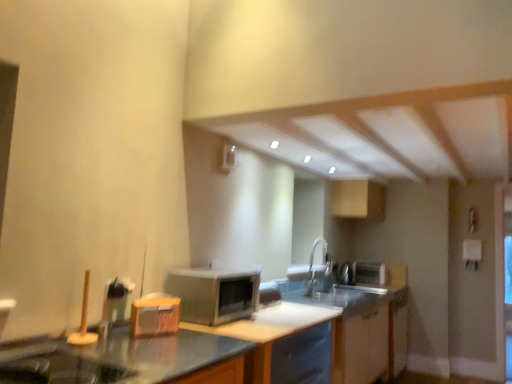
Where is `satin silver toaster at upper right, positioned as the second appliance in front-to-back order`? satin silver toaster at upper right, positioned as the second appliance in front-to-back order is located at coordinates (369, 273).

What is the approximate height of satin silver toaster at upper right, which is counted as the first appliance, starting from the right?

8.57 inches.

What do you see at coordinates (320, 272) in the screenshot? This screenshot has height=384, width=512. I see `silver metallic faucet at center` at bounding box center [320, 272].

The width and height of the screenshot is (512, 384). What do you see at coordinates (214, 294) in the screenshot?
I see `satin silver microwave at center` at bounding box center [214, 294].

Measure the distance between satin silver microwave at center and camera.

satin silver microwave at center is 6.93 feet away from camera.

The image size is (512, 384). Identify the location of white glossy cabinet at lower center, the first cabinetry positioned from the bottom. 362,328.

Measure the distance between point (328, 337) and camera.

Point (328, 337) is 2.63 meters away from camera.

The image size is (512, 384). Find the location of `white glossy counter top at center`. white glossy counter top at center is located at coordinates (269, 330).

Considering the sizes of satin silver microwave at center and silver metallic faucet at center in the image, is satin silver microwave at center bigger or smaller than silver metallic faucet at center?

In the image, satin silver microwave at center appears to be larger than silver metallic faucet at center.

Consider the image. Is satin silver microwave at center in contact with silver metallic faucet at center?

satin silver microwave at center and silver metallic faucet at center are clearly separated.

I want to click on faucet behind the satin silver microwave at center, so click(x=320, y=272).

Can you confirm if satin silver microwave at center is shorter than silver metallic faucet at center?

Yes, satin silver microwave at center is shorter than silver metallic faucet at center.

Are silver metallic faucet at center and matte wood cabinet at center, the second cabinetry from the front, making contact?

No, silver metallic faucet at center is not next to matte wood cabinet at center, the second cabinetry from the front.

Considering their positions, is silver metallic faucet at center located in front of or behind matte wood cabinet at center, placed as the first cabinetry when sorted from back to front?

Visually, silver metallic faucet at center is located in front of matte wood cabinet at center, placed as the first cabinetry when sorted from back to front.

Is silver metallic faucet at center wider than matte wood cabinet at center, acting as the 2th cabinetry starting from the bottom?

No, silver metallic faucet at center is not wider than matte wood cabinet at center, acting as the 2th cabinetry starting from the bottom.

Between silver metallic faucet at center and matte wood cabinet at center, acting as the 2th cabinetry starting from the bottom, which one has more height?

silver metallic faucet at center.

Is point (316, 319) in front of point (138, 313)?

No.

Based on the photo, who is more distant, white glossy counter top at center or wooden cutting board at left, which ranks as the first appliance in front-to-back order?

Positioned behind is wooden cutting board at left, which ranks as the first appliance in front-to-back order.

In terms of width, does white glossy counter top at center look wider or thinner when compared to wooden cutting board at left, the first appliance from the left?

In the image, white glossy counter top at center appears to be wider than wooden cutting board at left, the first appliance from the left.

Could wooden cutting board at left, the first appliance from the left, be considered to be inside white glossy counter top at center?

That's incorrect, wooden cutting board at left, the first appliance from the left, is not inside white glossy counter top at center.

Could you measure the distance between white glossy cabinet at lower center, placed as the 2th cabinetry when sorted from top to bottom, and white glossy counter top at center?

They are 31.95 inches apart.

Is white glossy cabinet at lower center, the second cabinetry from the back, far from white glossy counter top at center?

No, there isn't a large distance between white glossy cabinet at lower center, the second cabinetry from the back, and white glossy counter top at center.

Is white glossy cabinet at lower center, placed as the 2th cabinetry when sorted from top to bottom, turned away from white glossy counter top at center?

No, white glossy cabinet at lower center, placed as the 2th cabinetry when sorted from top to bottom, is not facing away from white glossy counter top at center.

What's the angular difference between white glossy cabinet at lower center, the second cabinetry from the back, and white glossy counter top at center's facing directions?

0.01 degrees.

Does wooden cutting board at left, the 1th appliance when ordered from top to bottom, have a lesser height compared to matte wood cabinet at center, the second cabinetry from the front?

Yes, wooden cutting board at left, the 1th appliance when ordered from top to bottom, is shorter than matte wood cabinet at center, the second cabinetry from the front.

Which is closer to the camera, (132, 328) or (358, 189)?

The point (132, 328) is in front.

In the scene shown: Is wooden cutting board at left, which appears as the second appliance when viewed from the back, turned away from matte wood cabinet at center, the first cabinetry in the top-to-bottom sequence?

No, matte wood cabinet at center, the first cabinetry in the top-to-bottom sequence, is not at the back of wooden cutting board at left, which appears as the second appliance when viewed from the back.

Which is behind, wooden cutting board at left, the first appliance from the left, or matte wood cabinet at center, acting as the 2th cabinetry starting from the bottom?

matte wood cabinet at center, acting as the 2th cabinetry starting from the bottom, is more distant.

From the image's perspective, which is below, satin silver microwave at center or wooden cutting board at left, which ranks as the second appliance in bottom-to-top order?

satin silver microwave at center, from the image's perspective.

Which object is closer to the camera, satin silver microwave at center or wooden cutting board at left, marked as the second appliance in a right-to-left arrangement?

wooden cutting board at left, marked as the second appliance in a right-to-left arrangement, is more forward.

Is satin silver microwave at center inside the boundaries of wooden cutting board at left, marked as the second appliance in a right-to-left arrangement, or outside?

satin silver microwave at center is spatially situated outside wooden cutting board at left, marked as the second appliance in a right-to-left arrangement.

Is point (275, 367) less distant than point (131, 312)?

No, it is not.

Consider the image. Is white glossy cabinet at lower center, the first cabinetry positioned from the bottom, not inside wooden cutting board at left, marked as the second appliance in a right-to-left arrangement?

Yes, white glossy cabinet at lower center, the first cabinetry positioned from the bottom, is outside of wooden cutting board at left, marked as the second appliance in a right-to-left arrangement.

From the image's perspective, is white glossy cabinet at lower center, the first cabinetry positioned from the bottom, located above or below wooden cutting board at left, the first appliance from the left?

white glossy cabinet at lower center, the first cabinetry positioned from the bottom, is situated lower than wooden cutting board at left, the first appliance from the left, in the image.

At what (x,y) coordinates should I click in order to perform the action: click on microwave oven on the left of silver metallic faucet at center. Please return your answer as a coordinate pair (x, y). This screenshot has width=512, height=384. Looking at the image, I should click on (214, 294).

You are a GUI agent. You are given a task and a screenshot of the screen. Output one action in this format:
    pyautogui.click(x=<x>, y=<y>)
    Task: Click on the faucet in front of the matte wood cabinet at center, acting as the 2th cabinetry starting from the bottom
    Image resolution: width=512 pixels, height=384 pixels.
    Given the screenshot: What is the action you would take?
    pyautogui.click(x=320, y=272)

From the picture: Which object lies nearer to the anchor point wooden cutting board at left, which ranks as the first appliance in front-to-back order, white glossy cabinet at lower center, the first cabinetry positioned from the bottom, or satin silver microwave at center?

Based on the image, satin silver microwave at center appears to be nearer to wooden cutting board at left, which ranks as the first appliance in front-to-back order.

From the picture: From the image, which object appears to be farther from white glossy counter top at center, satin silver microwave at center or white glossy cabinet at lower center, the second cabinetry from the back?

The object further to white glossy counter top at center is white glossy cabinet at lower center, the second cabinetry from the back.

Considering their positions, is satin silver toaster at upper right, which is counted as the first appliance, starting from the right, positioned further to silver metallic faucet at center than matte wood cabinet at center, placed as the first cabinetry when sorted from back to front?

Based on the image, satin silver toaster at upper right, which is counted as the first appliance, starting from the right, appears to be further to silver metallic faucet at center.

When comparing their distances from satin silver toaster at upper right, acting as the 1th appliance starting from the back, does satin silver microwave at center or wooden cutting board at left, which ranks as the second appliance in bottom-to-top order, seem further?

Among the two, wooden cutting board at left, which ranks as the second appliance in bottom-to-top order, is located further to satin silver toaster at upper right, acting as the 1th appliance starting from the back.

Estimate the real-world distances between objects in this image. Which object is closer to white glossy counter top at center, white glossy cabinet at lower center, placed as the 2th cabinetry when sorted from top to bottom, or satin silver toaster at upper right, positioned as the second appliance in front-to-back order?

Among the two, white glossy cabinet at lower center, placed as the 2th cabinetry when sorted from top to bottom, is located nearer to white glossy counter top at center.

Which object lies nearer to the anchor point satin silver microwave at center, white glossy counter top at center or silver metallic faucet at center?

Based on the image, white glossy counter top at center appears to be nearer to satin silver microwave at center.

Looking at this image, looking at the image, which one is located further to satin silver microwave at center, silver metallic faucet at center or white glossy counter top at center?

The object further to satin silver microwave at center is silver metallic faucet at center.

From the picture: From the image, which object appears to be nearer to wooden cutting board at left, the 1th appliance when ordered from top to bottom, white glossy cabinet at lower center, which is the 1th cabinetry in front-to-back order, or matte wood cabinet at center, the first cabinetry in the top-to-bottom sequence?

white glossy cabinet at lower center, which is the 1th cabinetry in front-to-back order.

I want to click on appliance located between white glossy counter top at center and matte wood cabinet at center, the second cabinetry from the front, in the depth direction, so click(x=154, y=315).

Find the location of a particular element. The height and width of the screenshot is (384, 512). faucet located between satin silver microwave at center and matte wood cabinet at center, placed as the first cabinetry when sorted from back to front, in the depth direction is located at coordinates (320, 272).

At what (x,y) coordinates should I click in order to perform the action: click on cabinetry between white glossy counter top at center and silver metallic faucet at center in the front-back direction. Please return your answer as a coordinate pair (x, y). This screenshot has height=384, width=512. Looking at the image, I should click on (362, 328).

Locate an element on the screen. The height and width of the screenshot is (384, 512). faucet between wooden cutting board at left, which ranks as the first appliance in front-to-back order, and satin silver toaster at upper right, positioned as the 2th appliance in left-to-right order, along the z-axis is located at coordinates (320, 272).